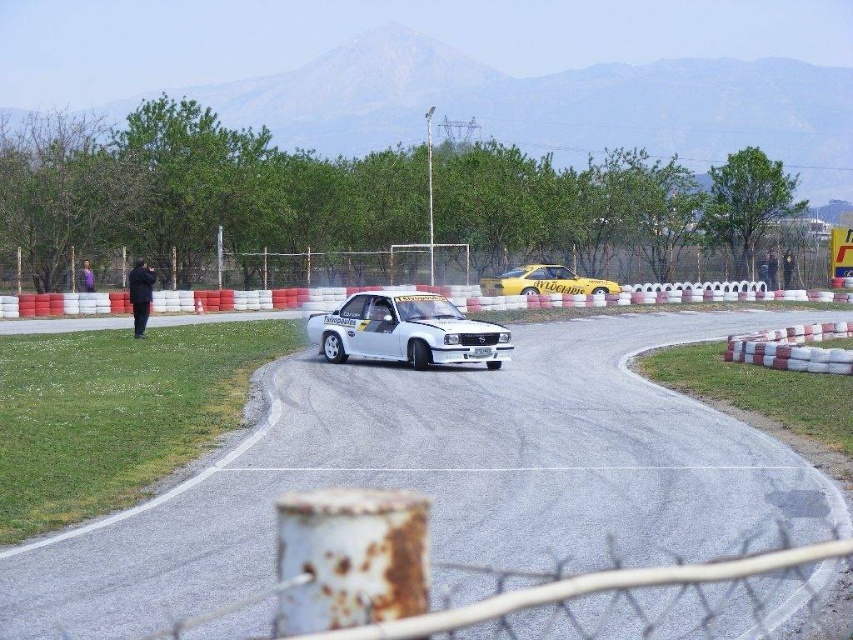
Can you confirm if white asphalt race track at center is thinner than yellow matte car at center?

No, white asphalt race track at center is not thinner than yellow matte car at center.

This screenshot has width=853, height=640. Describe the element at coordinates (450, 481) in the screenshot. I see `white asphalt race track at center` at that location.

Identify the location of white asphalt race track at center. The image size is (853, 640). (450, 481).

Who is more distant from viewer, [321,326] or [561,278]?

The point [561,278] is more distant.

Is white glossy car at center below yellow matte car at center?

Yes.

Who is more distant from viewer, (436, 320) or (602, 282)?

Positioned behind is point (602, 282).

At what (x,y) coordinates should I click in order to perform the action: click on white glossy car at center. Please return your answer as a coordinate pair (x, y). This screenshot has width=853, height=640. Looking at the image, I should click on (405, 332).

Is white asphalt race track at center shorter than white glossy car at center?

No, white asphalt race track at center is not shorter than white glossy car at center.

Is white asphalt race track at center positioned before white glossy car at center?

That is True.

This screenshot has width=853, height=640. Identify the location of white asphalt race track at center. (450, 481).